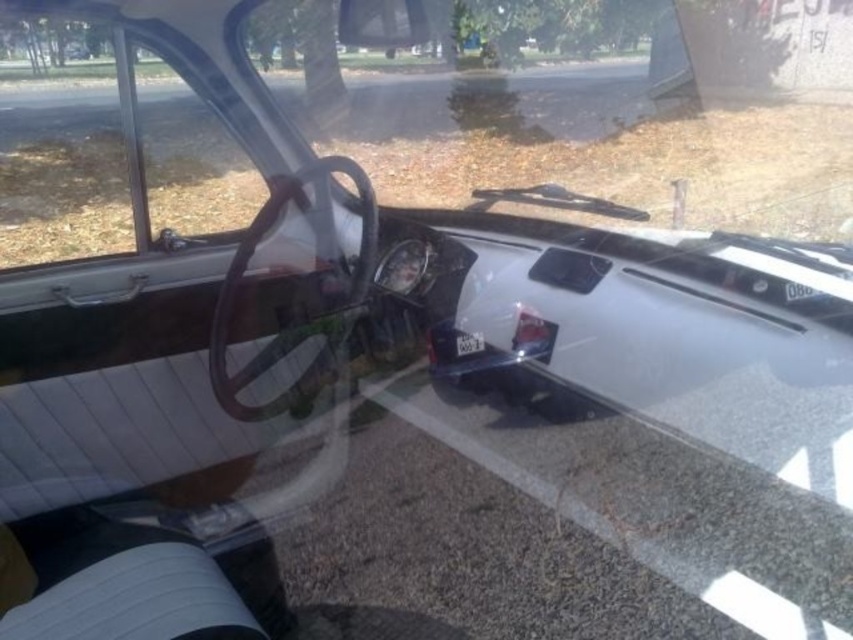
You are sitting in the driver seat of the vintage car and want to look outside through the transparent glass windshield at center and the clear glass window at left. Which one allows you to see the exterior environment first?

The transparent glass windshield at center allows you to see the exterior environment first because the clear glass window at left is behind it.

You are a delivery robot with a height of 5 feet. You need to transport a package through the space between the transparent glass windshield at center and the clear glass window at left. Can you pass through this space without bending down?

The distance between the transparent glass windshield at center and the clear glass window at left is 15.30 feet. Since your height is 5 feet, which is less than the available space, you can pass through without bending down.